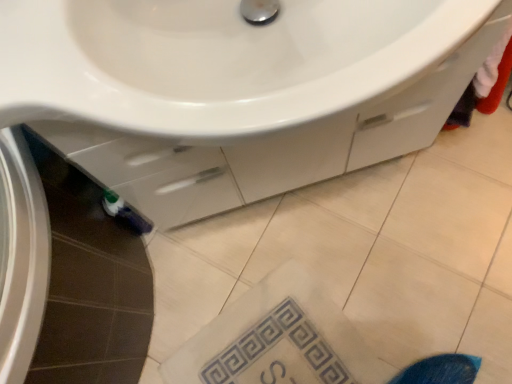
Measure the distance between white glossy sink at center and camera.

white glossy sink at center is 18.85 inches away from camera.

Image resolution: width=512 pixels, height=384 pixels. What do you see at coordinates (217, 61) in the screenshot?
I see `white glossy sink at center` at bounding box center [217, 61].

Locate an element on the screen. This screenshot has height=384, width=512. white glossy sink at center is located at coordinates (217, 61).

The width and height of the screenshot is (512, 384). Identify the location of white glossy sink at center. (217, 61).